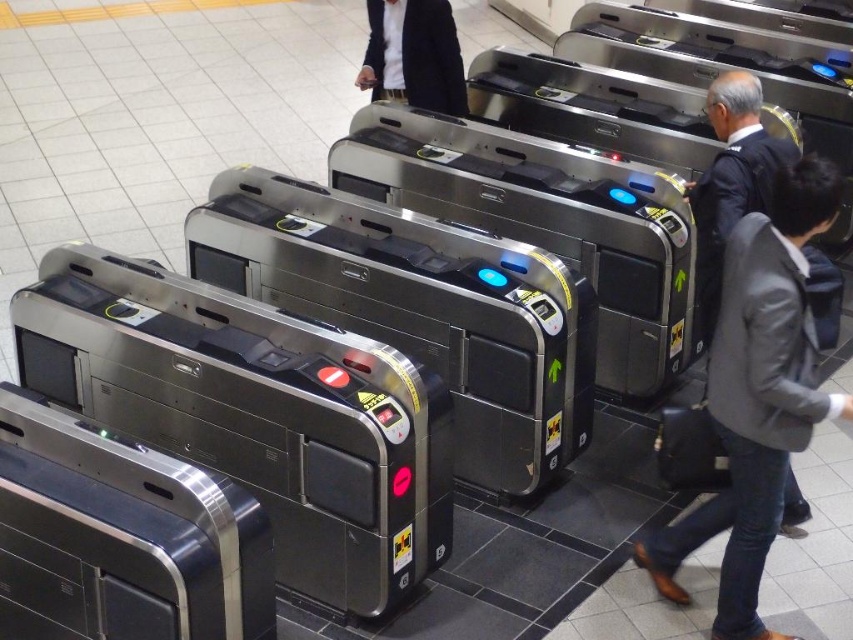
Question: Can you confirm if gray fabric jacket at right is thinner than dark gray wool suit at center?

Choices:
 (A) no
 (B) yes

Answer: (B)

Question: Which object appears farthest from the camera in this image?

Choices:
 (A) gray fabric jacket at right
 (B) dark gray wool suit at center

Answer: (B)

Question: Which of these objects is positioned closest to the dark gray suit at right?

Choices:
 (A) leather suitcase at right
 (B) gray fabric jacket at right

Answer: (B)

Question: Can you confirm if gray fabric jacket at right is thinner than dark gray suit at right?

Choices:
 (A) yes
 (B) no

Answer: (B)

Question: Considering the relative positions of gray fabric jacket at right and dark gray wool suit at center in the image provided, where is gray fabric jacket at right located with respect to dark gray wool suit at center?

Choices:
 (A) below
 (B) above

Answer: (A)

Question: Which point is farther to the camera?

Choices:
 (A) gray fabric jacket at right
 (B) dark gray suit at right

Answer: (B)